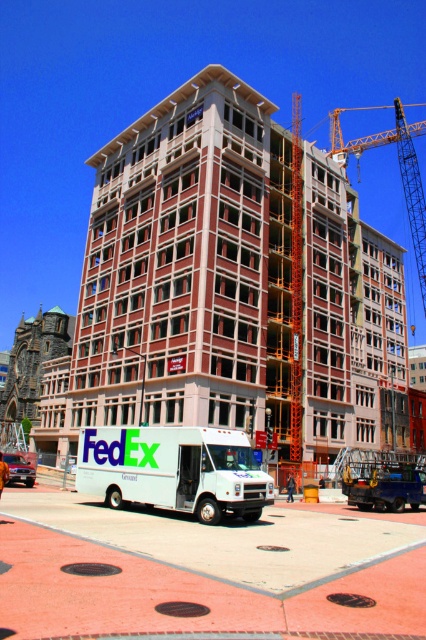
Question: Is white concrete construction site at center further to the viewer compared to white matte fedex truck at center?

Choices:
 (A) yes
 (B) no

Answer: (B)

Question: Can you confirm if white concrete construction site at center is thinner than white matte fedex truck at center?

Choices:
 (A) no
 (B) yes

Answer: (A)

Question: Estimate the real-world distances between objects in this image. Which object is closer to the white matte fedex truck at center?

Choices:
 (A) orange metallic crane at upper right
 (B) white glossy fedex truck at center
 (C) white concrete construction site at center

Answer: (B)

Question: Which of the following is the closest to the observer?

Choices:
 (A) orange metallic crane at upper right
 (B) white matte fedex truck at center

Answer: (B)

Question: Which object is farther from the camera taking this photo?

Choices:
 (A) white concrete construction site at center
 (B) orange metallic crane at upper right
 (C) white matte fedex truck at center

Answer: (B)

Question: Can you confirm if white glossy fedex truck at center is smaller than orange metallic crane at upper right?

Choices:
 (A) no
 (B) yes

Answer: (B)